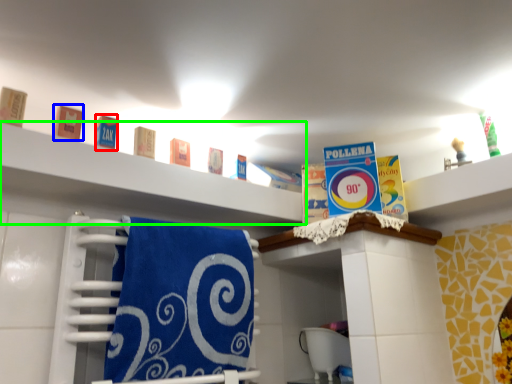
Question: Which is farther away from product (highlighted by a red box)? product (highlighted by a blue box) or shelf (highlighted by a green box)?

Choices:
 (A) product
 (B) shelf

Answer: (B)